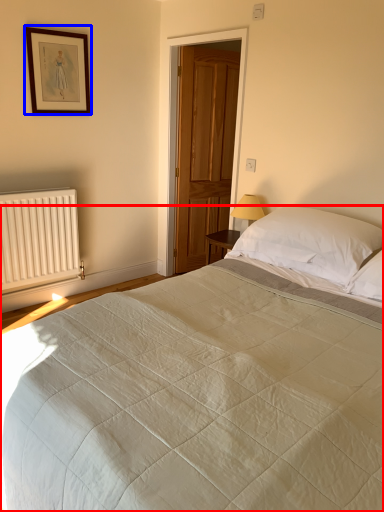
Question: Which point is closer to the camera, bed (highlighted by a red box) or picture frame (highlighted by a blue box)?

Choices:
 (A) bed
 (B) picture frame

Answer: (A)